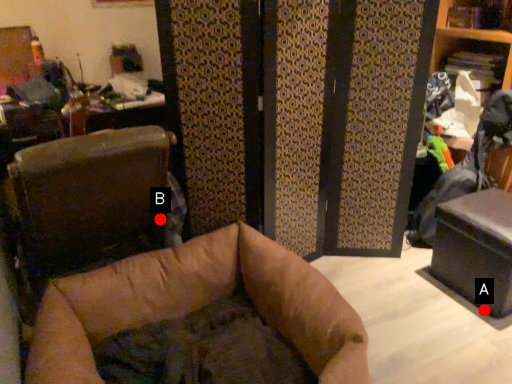
Question: Two points are circled on the image, labeled by A and B beside each circle. Which point is closer to the camera?

Choices:
 (A) A is closer
 (B) B is closer

Answer: (A)